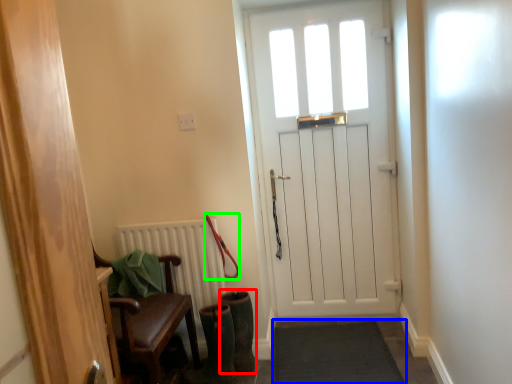
Question: Which object is the closest to the boot (highlighted by a red box)? Choose among these: doormat (highlighted by a blue box) or leash (highlighted by a green box).

Choices:
 (A) doormat
 (B) leash

Answer: (B)